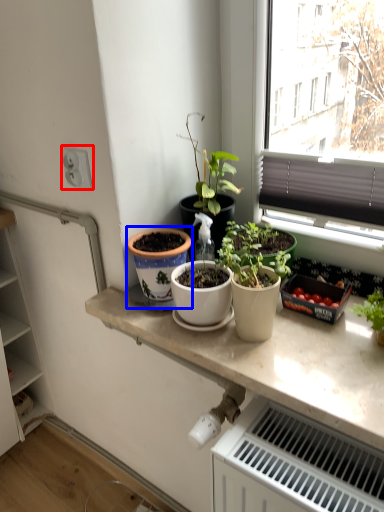
Question: Which object is closer to the camera taking this photo, electric outlet (highlighted by a red box) or flowerpot (highlighted by a blue box)?

Choices:
 (A) electric outlet
 (B) flowerpot

Answer: (B)